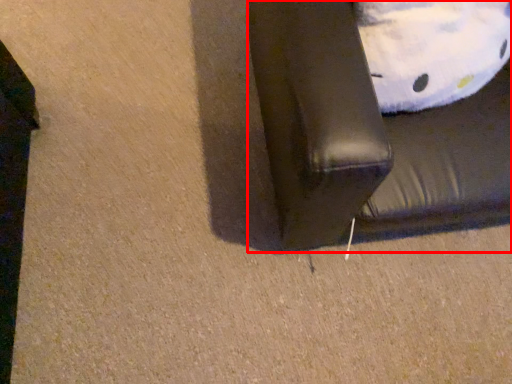
Question: From the image's perspective, what is the correct spatial relationship of furniture (annotated by the red box) in relation to pillow?

Choices:
 (A) above
 (B) below

Answer: (B)